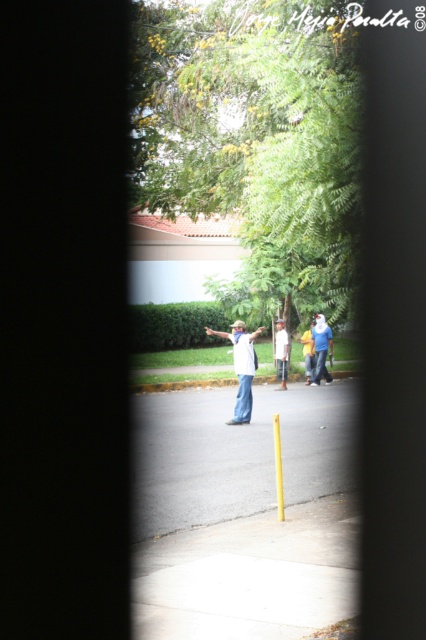
Question: Among these objects, which one is farthest from the camera?

Choices:
 (A) blue jeans at center
 (B) yellow plastic pole at center

Answer: (A)

Question: Is white cotton shirt at center above blue denim jeans at center?

Choices:
 (A) yes
 (B) no

Answer: (B)

Question: Which of the following is the closest to the observer?

Choices:
 (A) yellow plastic pole at center
 (B) yellow asphalt at center
 (C) white cotton shirt at center
 (D) blue denim jeans at center

Answer: (B)

Question: Does yellow asphalt at center appear under blue jeans at center?

Choices:
 (A) no
 (B) yes

Answer: (B)

Question: Does yellow asphalt at center appear over blue denim jeans at center?

Choices:
 (A) yes
 (B) no

Answer: (B)

Question: Among these points, which one is nearest to the camera?

Choices:
 (A) (278, 445)
 (B) (310, 326)

Answer: (A)